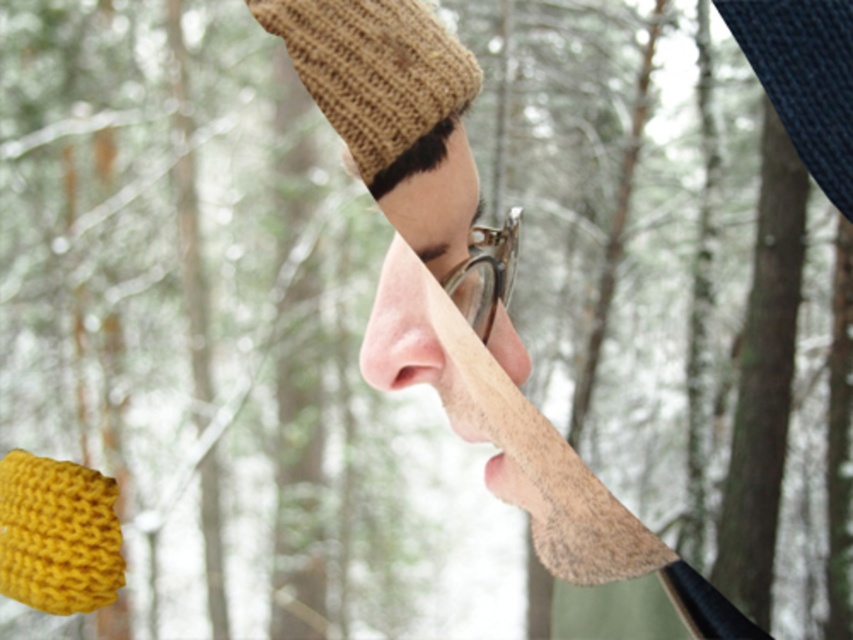
Question: Among these objects, which one is farthest from the camera?

Choices:
 (A) pink smooth nose at center
 (B) smooth skin nose at center

Answer: (A)

Question: Is knitted brown hat at upper center smaller than knitted yellow scarf at lower left?

Choices:
 (A) yes
 (B) no

Answer: (B)

Question: Does knitted brown hat at upper center have a larger size compared to knitted yellow scarf at lower left?

Choices:
 (A) yes
 (B) no

Answer: (A)

Question: Which is nearer to the smooth skin nose at center?

Choices:
 (A) pink smooth nose at center
 (B) knitted yellow scarf at lower left
 (C) knitted brown hat at upper center

Answer: (A)

Question: Is knitted brown hat at upper center thinner than smooth skin nose at center?

Choices:
 (A) no
 (B) yes

Answer: (A)

Question: Which of the following is the closest to the observer?

Choices:
 (A) (426, 221)
 (B) (312, 54)
 (C) (374, 316)

Answer: (C)